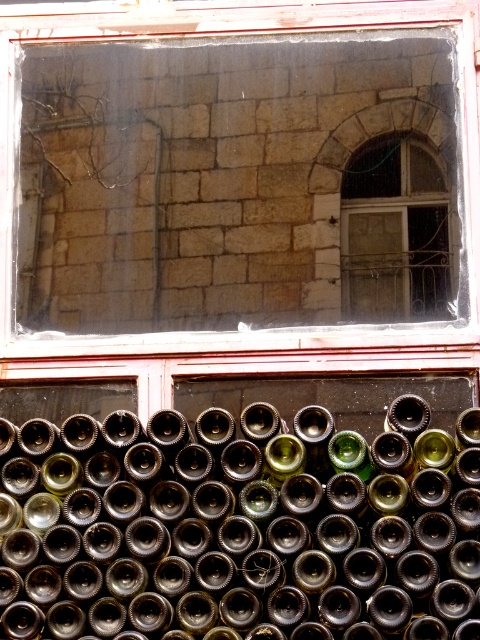
Is clear glass window at upper center smaller than dark brown glass bottles at bottom?

Yes.

The height and width of the screenshot is (640, 480). Describe the element at coordinates (239, 177) in the screenshot. I see `clear glass window at upper center` at that location.

Where is `clear glass window at upper center`? Image resolution: width=480 pixels, height=640 pixels. clear glass window at upper center is located at coordinates (239, 177).

Between dark brown glass bottles at bottom and matte glass window at upper right, which one is positioned lower?

dark brown glass bottles at bottom is lower down.

Can you confirm if dark brown glass bottles at bottom is positioned to the left of matte glass window at upper right?

Yes, dark brown glass bottles at bottom is to the left of matte glass window at upper right.

What do you see at coordinates (239, 528) in the screenshot? This screenshot has width=480, height=640. I see `dark brown glass bottles at bottom` at bounding box center [239, 528].

Locate an element on the screen. dark brown glass bottles at bottom is located at coordinates (239, 528).

Which is behind, point (324, 227) or point (370, 220)?

Positioned behind is point (370, 220).

Between clear glass window at upper center and matte glass window at upper right, which one appears on the left side from the viewer's perspective?

clear glass window at upper center

This screenshot has width=480, height=640. Identify the location of clear glass window at upper center. (239, 177).

Where is `clear glass window at upper center`? This screenshot has height=640, width=480. clear glass window at upper center is located at coordinates [x=239, y=177].